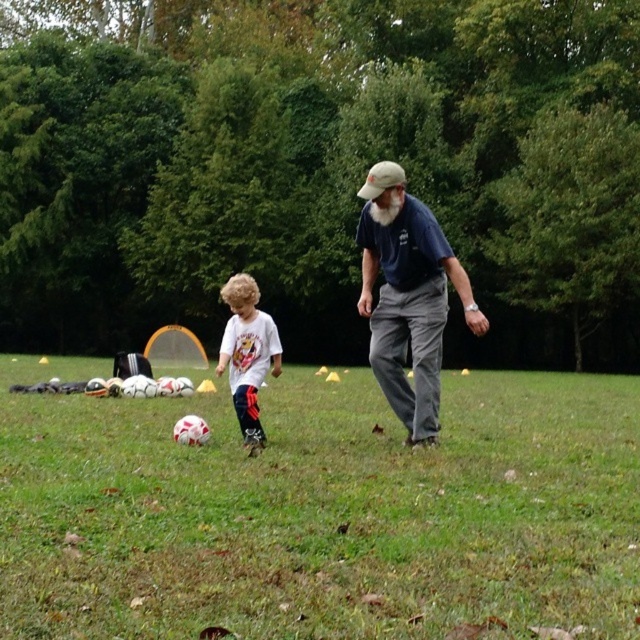
Based on the photo, you are a photographer wanting to capture the dark blue shirt at center and the green grass at center in a single shot. Given that your camera can only focus on one object at a time, which object should you focus on to ensure the other remains in the background?

The green grass at center is larger in size than dark blue shirt at center, so focusing on the dark blue shirt at center would keep the green grass at center in the background.